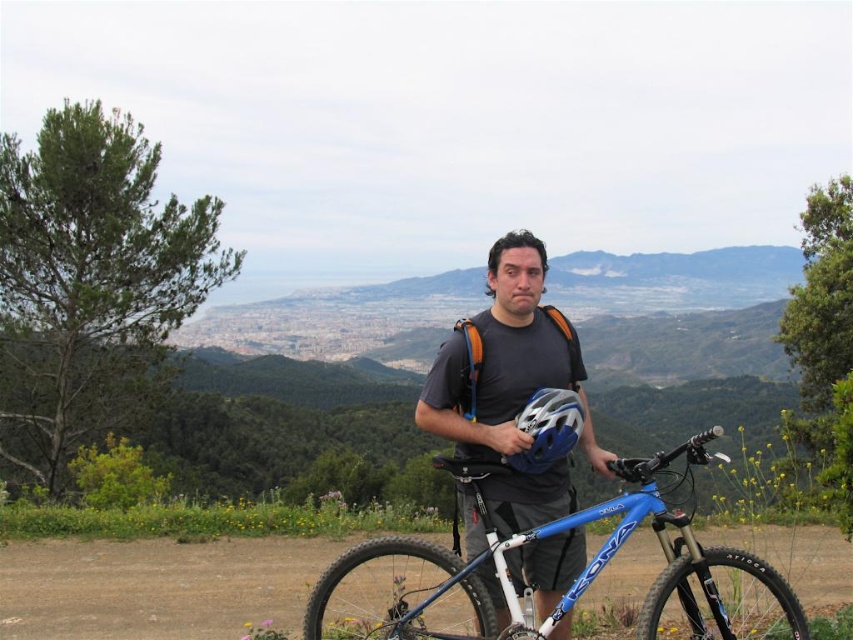
How distant is blue metallic bicycle at center from matte black helmet at center?

blue metallic bicycle at center is 2.04 meters away from matte black helmet at center.

Is blue metallic bicycle at center to the right of matte black helmet at center from the viewer's perspective?

Indeed, blue metallic bicycle at center is positioned on the right side of matte black helmet at center.

Between point (668, 552) and point (503, 483), which one is positioned behind?

Positioned behind is point (503, 483).

You are a GUI agent. You are given a task and a screenshot of the screen. Output one action in this format:
    pyautogui.click(x=<x>, y=<y>)
    Task: Click on the blue metallic bicycle at center
    
    Given the screenshot: What is the action you would take?
    pyautogui.click(x=560, y=589)

Is blue metallic bicycle at center closer to camera compared to blue/white matte bicycle helmet at center?

That is True.

Is blue metallic bicycle at center wider than blue/white matte bicycle helmet at center?

Yes, blue metallic bicycle at center is wider than blue/white matte bicycle helmet at center.

Who is more forward, [769,586] or [531,419]?

Positioned in front is point [769,586].

This screenshot has width=853, height=640. I want to click on blue metallic bicycle at center, so click(x=560, y=589).

Can you confirm if matte black helmet at center is shorter than blue/white matte bicycle helmet at center?

In fact, matte black helmet at center may be taller than blue/white matte bicycle helmet at center.

Between matte black helmet at center and blue/white matte bicycle helmet at center, which one is positioned lower?

matte black helmet at center is lower down.

Where is `matte black helmet at center`? This screenshot has height=640, width=853. matte black helmet at center is located at coordinates (505, 360).